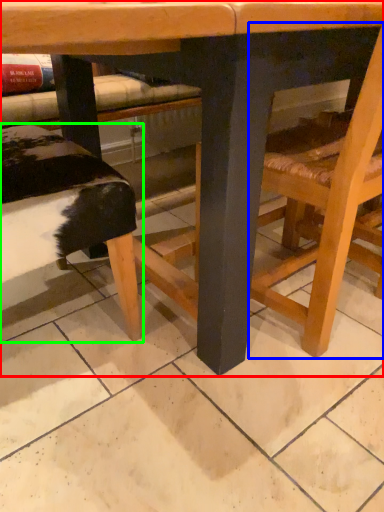
Question: Estimate the real-world distances between objects in this image. Which object is farther from table (highlighted by a red box), chair (highlighted by a blue box) or park bench (highlighted by a green box)?

Choices:
 (A) chair
 (B) park bench

Answer: (B)